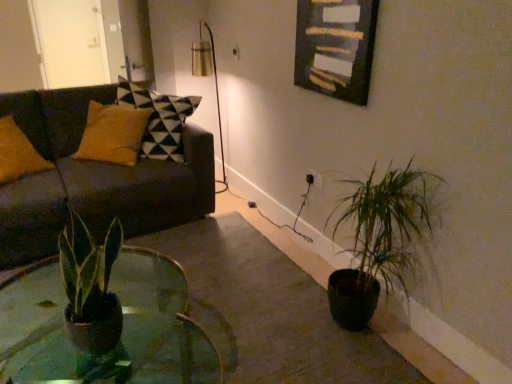
Question: Does white glossy door at upper left appear on the right side of green matte plant at lower right?

Choices:
 (A) no
 (B) yes

Answer: (A)

Question: From the image's perspective, is white glossy door at upper left on top of green matte plant at lower right?

Choices:
 (A) no
 (B) yes

Answer: (B)

Question: From a real-world perspective, is white glossy door at upper left under green matte plant at lower right?

Choices:
 (A) no
 (B) yes

Answer: (A)

Question: Is white glossy door at upper left bigger than green matte plant at lower right?

Choices:
 (A) no
 (B) yes

Answer: (A)

Question: Is white glossy door at upper left outside of green matte plant at lower right?

Choices:
 (A) no
 (B) yes

Answer: (B)

Question: Visually, is wooden frame at upper center positioned to the left or to the right of green matte plant at lower right?

Choices:
 (A) right
 (B) left

Answer: (B)

Question: From a real-world perspective, is wooden frame at upper center positioned above or below green matte plant at lower right?

Choices:
 (A) below
 (B) above

Answer: (B)

Question: From their relative heights in the image, would you say wooden frame at upper center is taller or shorter than green matte plant at lower right?

Choices:
 (A) short
 (B) tall

Answer: (A)

Question: Is wooden frame at upper center wider or thinner than green matte plant at lower right?

Choices:
 (A) thin
 (B) wide

Answer: (A)

Question: In the image, is wooden frame at upper center on the left side or the right side of dark gray fabric couch at left?

Choices:
 (A) right
 (B) left

Answer: (A)

Question: In the image, is wooden frame at upper center positioned in front of or behind dark gray fabric couch at left?

Choices:
 (A) front
 (B) behind

Answer: (A)

Question: Based on their sizes in the image, would you say wooden frame at upper center is bigger or smaller than dark gray fabric couch at left?

Choices:
 (A) big
 (B) small

Answer: (B)

Question: Is wooden frame at upper center inside the boundaries of dark gray fabric couch at left, or outside?

Choices:
 (A) outside
 (B) inside

Answer: (A)

Question: Looking at their shapes, would you say green matte plant at lower right is wider or thinner than wooden frame at upper center?

Choices:
 (A) wide
 (B) thin

Answer: (A)

Question: From the image's perspective, is green matte plant at lower right located above or below wooden frame at upper center?

Choices:
 (A) below
 (B) above

Answer: (A)